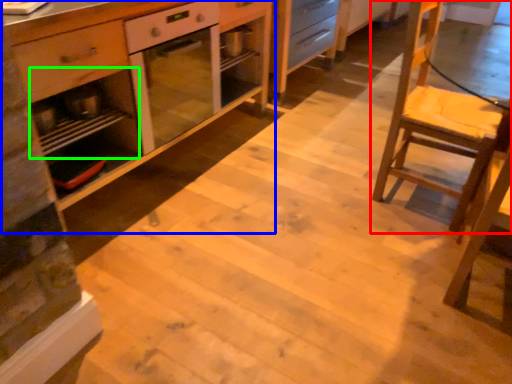
Question: Which is nearer to the chair (highlighted by a red box)? cabinetry (highlighted by a blue box) or shelf (highlighted by a green box).

Choices:
 (A) cabinetry
 (B) shelf

Answer: (A)